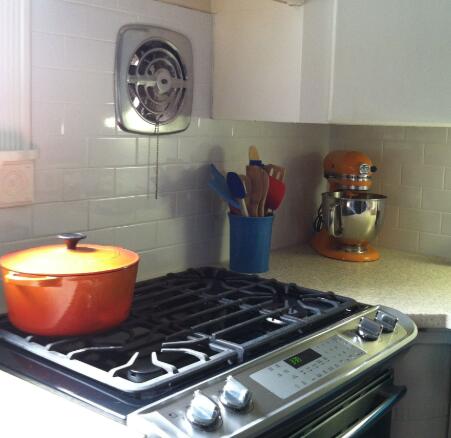
At what (x,y) coordinates should I click in order to perform the action: click on orange pot. Please return your answer as a coordinate pair (x, y). Image resolution: width=451 pixels, height=438 pixels. Looking at the image, I should click on (70, 299).